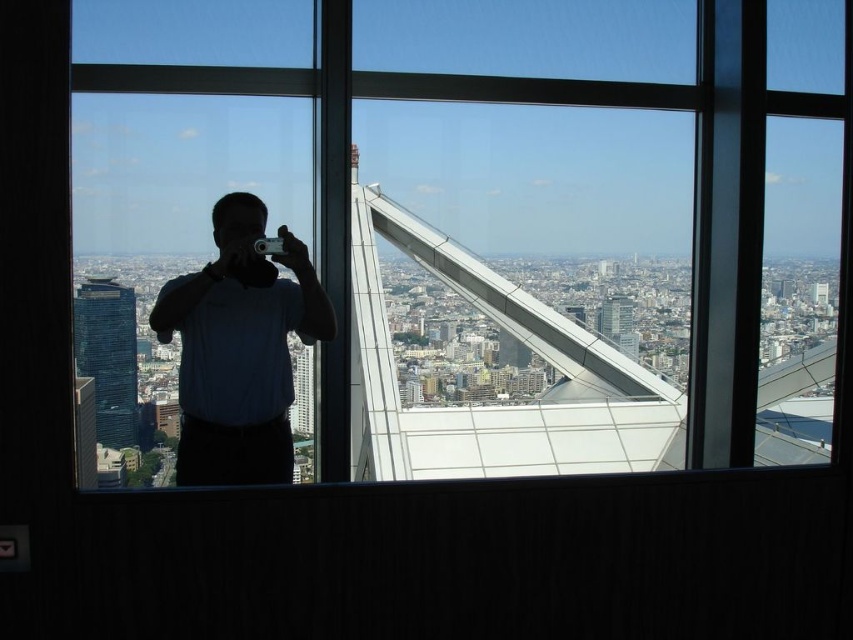
Is point (154, 184) in front of point (180, 339)?

No, it is behind (180, 339).

Between transparent glass window at center and matte blue shirt at center, which one is positioned higher?

transparent glass window at center is higher up.

What do you see at coordinates (462, 228) in the screenshot? I see `transparent glass window at center` at bounding box center [462, 228].

This screenshot has height=640, width=853. I want to click on transparent glass window at center, so click(x=462, y=228).